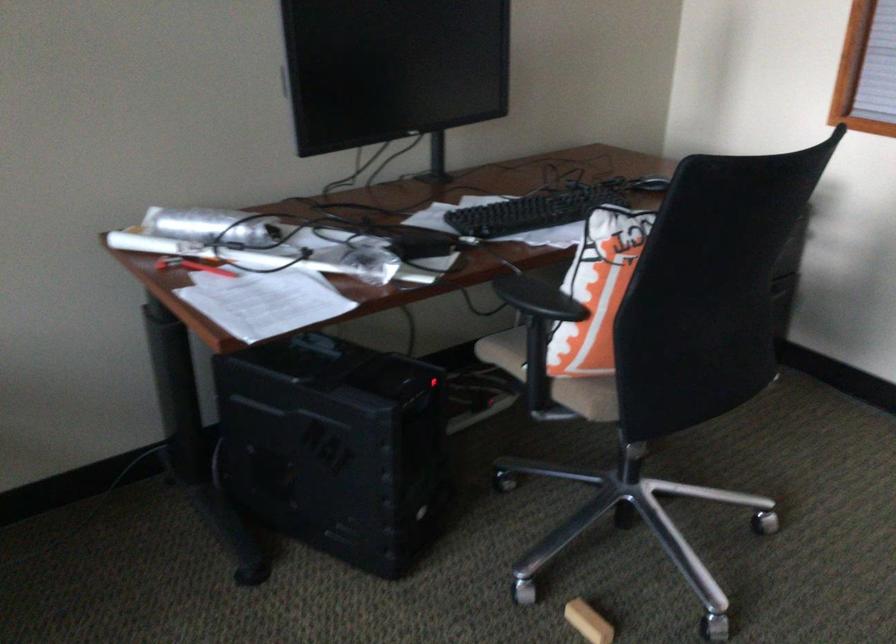
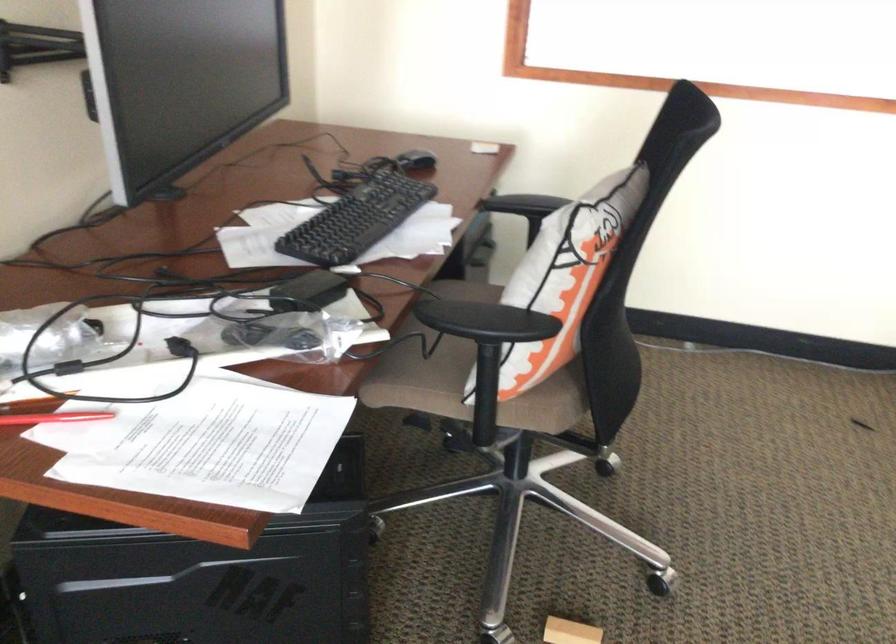
Question: The camera is either moving clockwise (left) or counter-clockwise (right) around the object. The first image is from the beginning of the video and the second image is from the end. Is the camera moving left or right when shooting the video?

Choices:
 (A) Left
 (B) Right

Answer: (A)